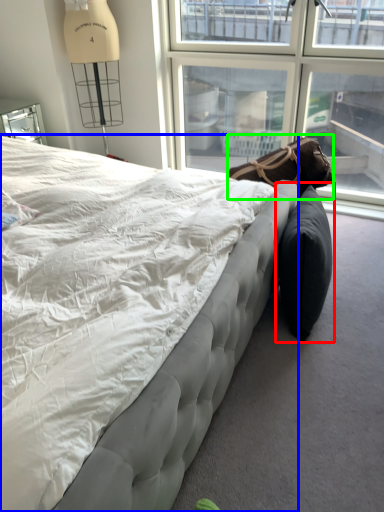
Question: Which object is the closest to the bean bag chair (highlighted by a red box)? Choose among these: bed (highlighted by a blue box) or bean bag chair (highlighted by a green box).

Choices:
 (A) bed
 (B) bean bag chair

Answer: (B)